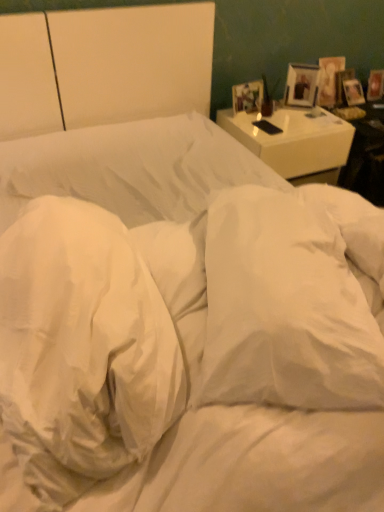
What are the coordinates of `vacant space situated above white glossy nightstand at upper right (from a real-world perspective)` in the screenshot? It's located at (273, 113).